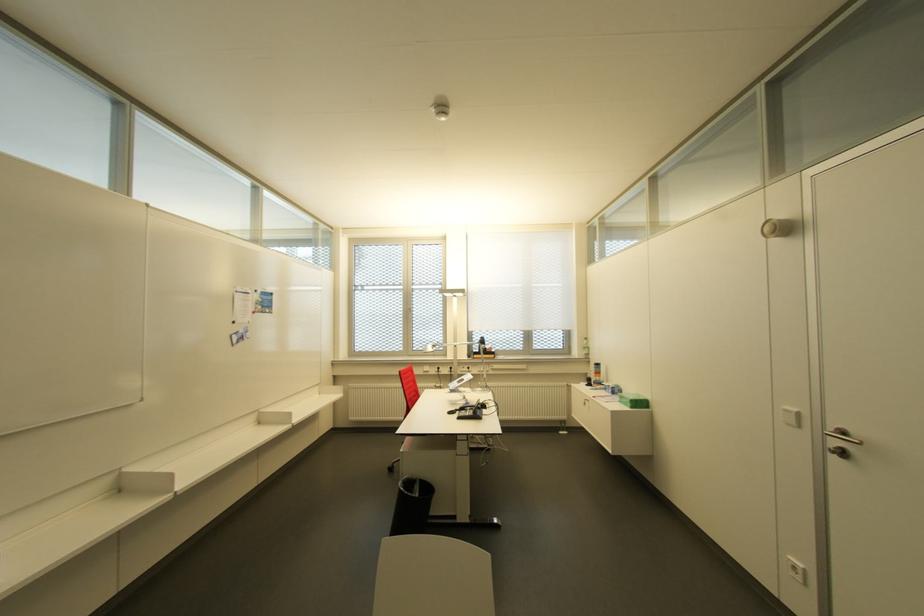
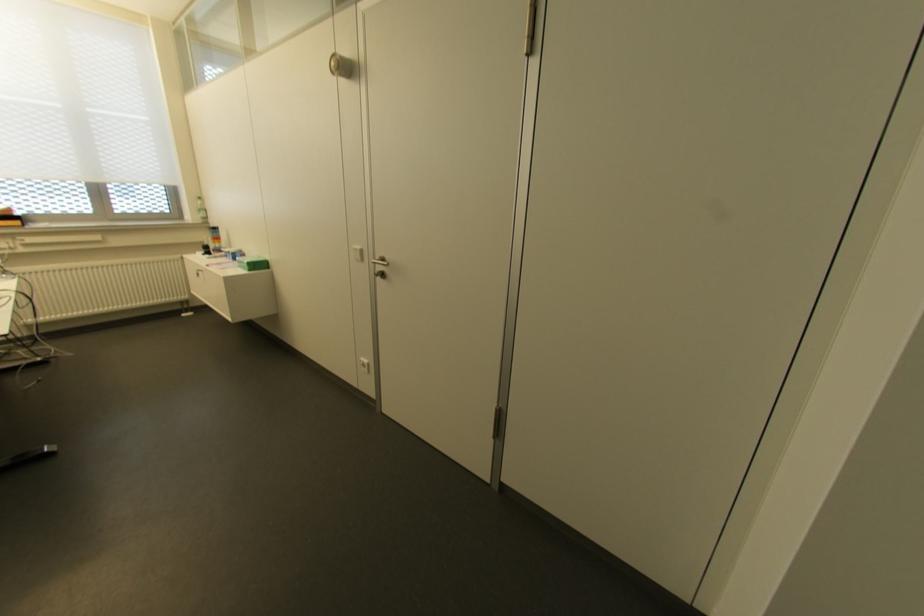
Locate, in the second image, the point that corresponds to (593,377) in the first image.

(213, 243)